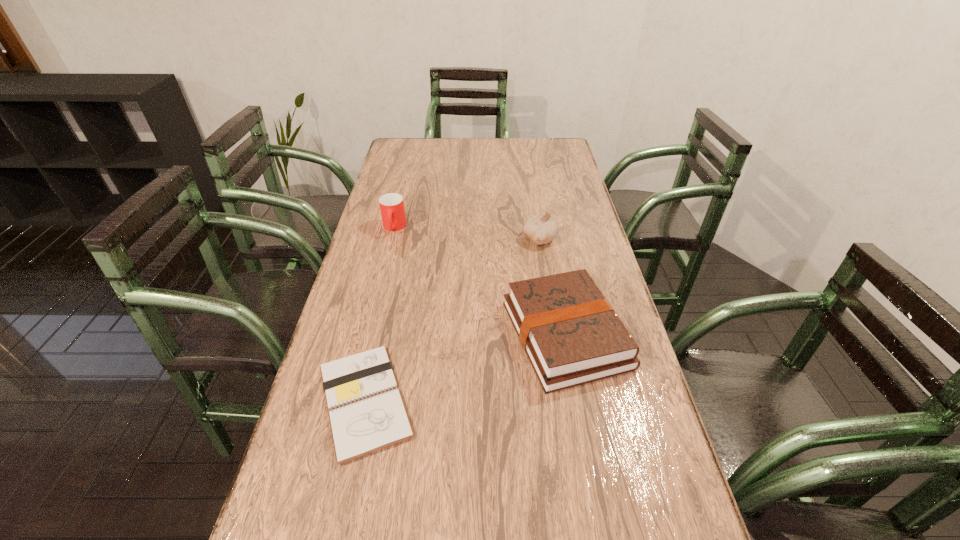
Identify the location of garlic that is at the right edge. The width and height of the screenshot is (960, 540). (541, 229).

The height and width of the screenshot is (540, 960). What are the coordinates of `hardback book situated at the right edge` in the screenshot? It's located at (572, 336).

Where is `vacant region at the far edge of the desktop`? vacant region at the far edge of the desktop is located at coordinates (517, 145).

Identify the location of vacant space at the left edge of the desktop. Image resolution: width=960 pixels, height=540 pixels. (399, 266).

Locate an element on the screen. free space at the right edge of the desktop is located at coordinates (631, 443).

The height and width of the screenshot is (540, 960). Identify the location of vacant region at the far left corner of the desktop. (420, 146).

Where is `empty space that is in between the hardback book and the shortest object`? The image size is (960, 540). empty space that is in between the hardback book and the shortest object is located at coordinates (466, 368).

Where is `empty space that is in between the garlic and the shortest object`? empty space that is in between the garlic and the shortest object is located at coordinates (452, 320).

Where is `vacant point located between the cup and the hardback book`? vacant point located between the cup and the hardback book is located at coordinates (480, 281).

I want to click on blank region between the cup and the notepad, so click(x=379, y=314).